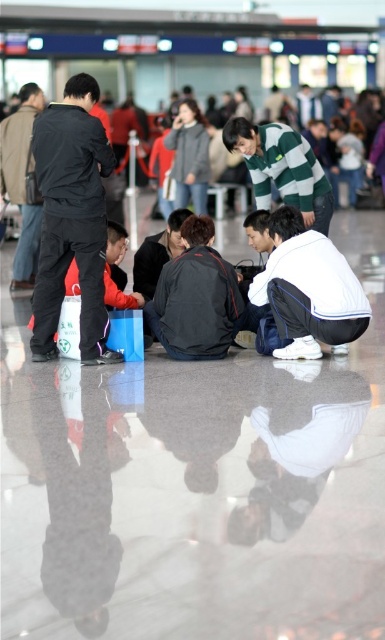
Does black matte jacket at left have a greater height compared to green striped shirt at center?

Correct, black matte jacket at left is much taller as green striped shirt at center.

Does black matte jacket at left appear under green striped shirt at center?

Indeed, black matte jacket at left is positioned under green striped shirt at center.

Find the location of a particular element. The width and height of the screenshot is (385, 640). black matte jacket at left is located at coordinates (71, 218).

Locate an element on the screen. Image resolution: width=385 pixels, height=640 pixels. black matte jacket at left is located at coordinates (71, 218).

Does point (246, 129) come closer to viewer compared to point (20, 253)?

Yes, point (246, 129) is closer to viewer.

Is point (313, 202) more distant than point (23, 257)?

No, it is in front of (23, 257).

Where is `green striped shirt at center`? The width and height of the screenshot is (385, 640). green striped shirt at center is located at coordinates (281, 168).

Does point (339, 310) come farther from viewer compared to point (177, 241)?

No, (339, 310) is in front of (177, 241).

Based on the photo, who is higher up, white matte jacket at center or dark gray sweater at center?

dark gray sweater at center

Is point (353, 308) less distant than point (162, 248)?

Yes, point (353, 308) is in front of point (162, 248).

Locate an element on the screen. The width and height of the screenshot is (385, 640). white matte jacket at center is located at coordinates (309, 289).